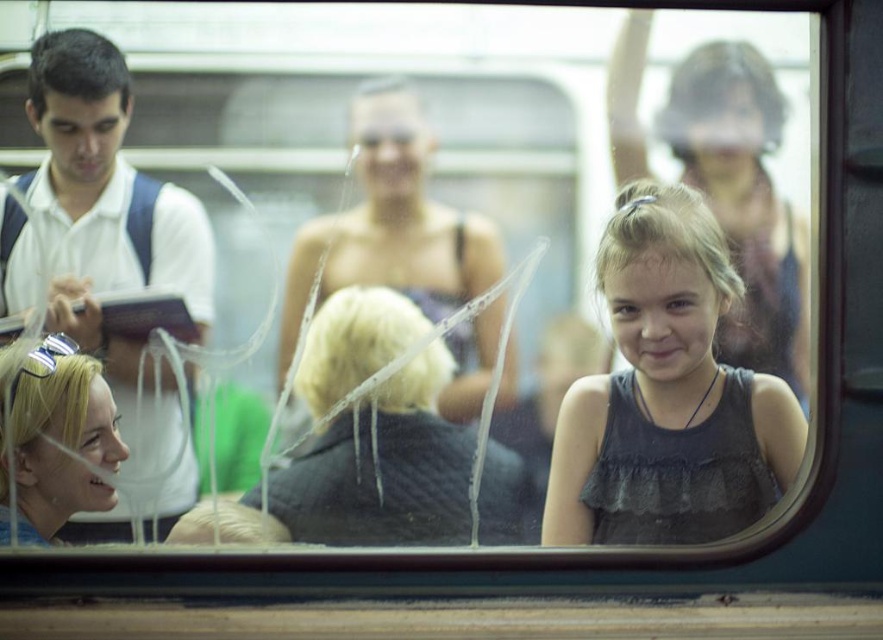
Is dark gray textured sweater at center closer to camera compared to matte black dress at upper right?

No.

Who is positioned more to the right, dark gray textured sweater at center or matte black dress at upper right?

From the viewer's perspective, matte black dress at upper right appears more on the right side.

Which is in front, point (284, 522) or point (638, 92)?

Positioned in front is point (638, 92).

Locate an element on the screen. Image resolution: width=883 pixels, height=640 pixels. dark gray textured sweater at center is located at coordinates (383, 468).

Between dark gray textured sweater at center and blonde hair at lower left, which one appears on the right side from the viewer's perspective?

dark gray textured sweater at center

Who is positioned more to the left, dark gray textured sweater at center or blonde hair at lower left?

From the viewer's perspective, blonde hair at lower left appears more on the left side.

At what (x,y) coordinates should I click in order to perform the action: click on dark gray textured sweater at center. Please return your answer as a coordinate pair (x, y). The image size is (883, 640). Looking at the image, I should click on (383, 468).

Between point (425, 452) and point (450, 413), which one is positioned in front?

Point (450, 413) is in front.

Who is more forward, (410, 426) or (364, 232)?

Point (364, 232) is more forward.

This screenshot has height=640, width=883. Identify the location of dark gray textured sweater at center. (383, 468).